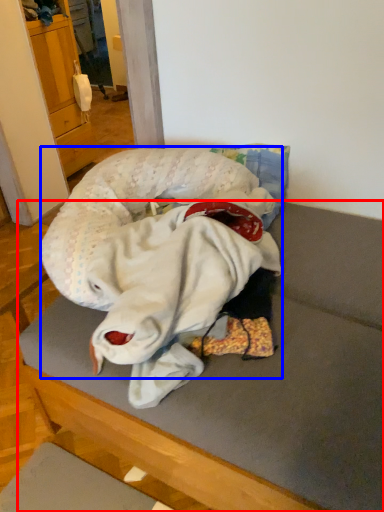
Question: Which object appears closest to the camera in this image, furniture (highlighted by a red box) or baby (highlighted by a blue box)?

Choices:
 (A) furniture
 (B) baby

Answer: (A)